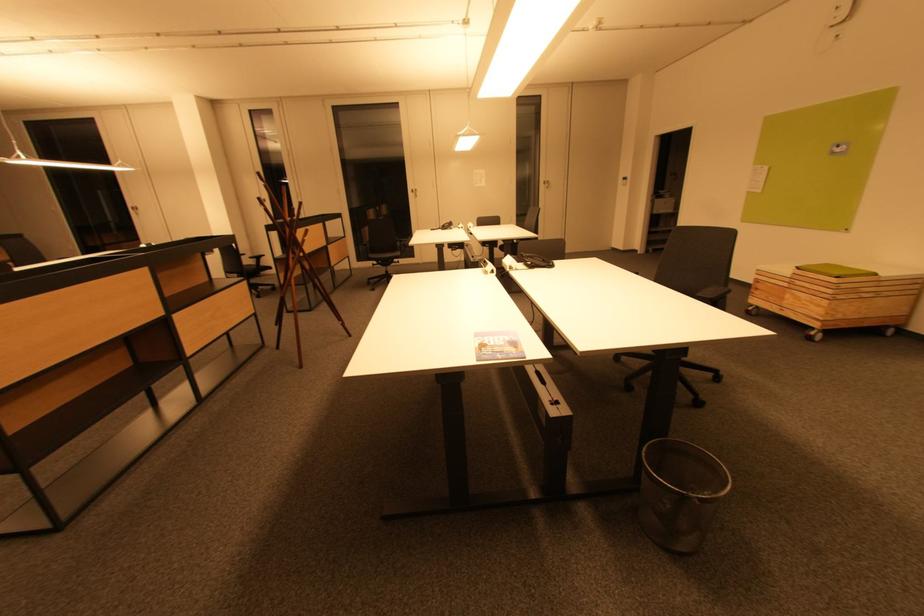
Describe the element at coordinates (419, 192) in the screenshot. I see `the silver door handle` at that location.